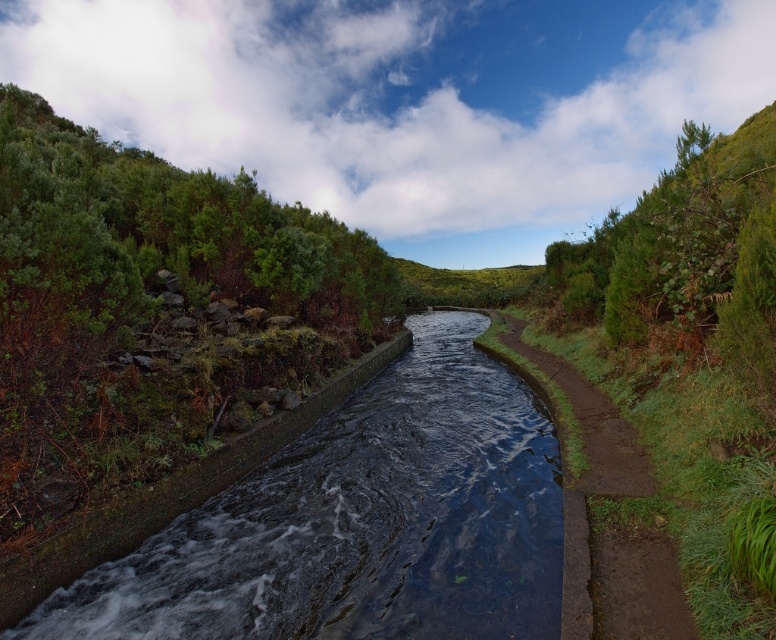
Can you confirm if green leafy shrubs at upper left is taller than dark concrete stream at center?

Indeed, green leafy shrubs at upper left has a greater height compared to dark concrete stream at center.

Which is more to the right, green leafy shrubs at upper left or dark concrete stream at center?

dark concrete stream at center

Measure the distance between point (5,269) and camera.

The distance of point (5,269) from camera is 5.39 meters.

Find the location of a particular element. green leafy shrubs at upper left is located at coordinates (147, 308).

Consider the image. Who is higher up, green leafy shrubs at upper left or green grassy trail at center-right?

green leafy shrubs at upper left is above.

Which of these two, green leafy shrubs at upper left or green grassy trail at center-right, stands shorter?

green grassy trail at center-right

Between point (168, 205) and point (676, 576), which one is positioned behind?

Positioned behind is point (168, 205).

Where is `green leafy shrubs at upper left`? green leafy shrubs at upper left is located at coordinates (147, 308).

Which of these two, dark concrete stream at center or green grassy trail at center-right, stands shorter?

green grassy trail at center-right

This screenshot has width=776, height=640. What do you see at coordinates (359, 522) in the screenshot? I see `dark concrete stream at center` at bounding box center [359, 522].

Is point (487, 429) closer to camera compared to point (624, 563)?

No, it is not.

Identify the location of dark concrete stream at center. This screenshot has width=776, height=640. (359, 522).